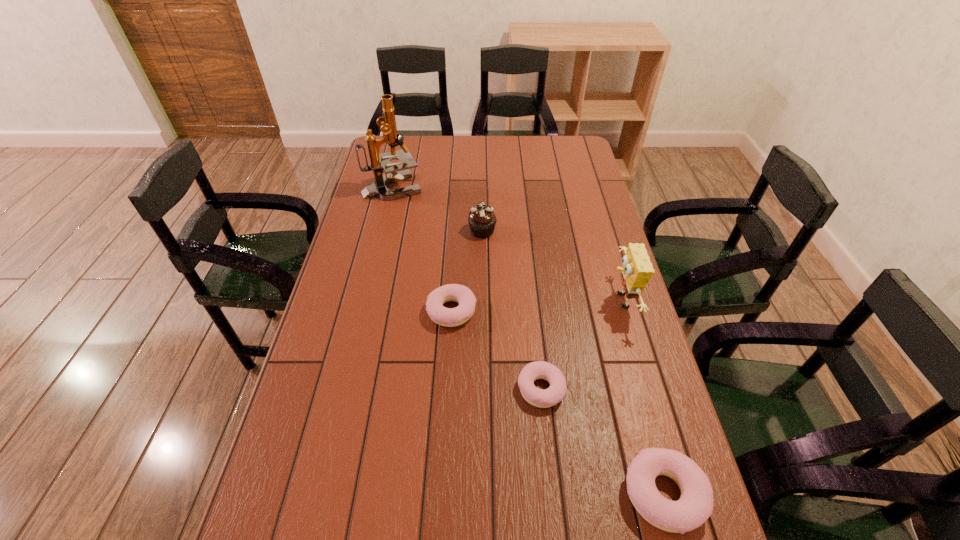
Identify the location of cupcake. The width and height of the screenshot is (960, 540). (482, 220).

Locate an element on the screen. This screenshot has height=540, width=960. free spot located 0.360m on the back of the second shortest doughnut is located at coordinates (457, 219).

Locate an element on the screen. The height and width of the screenshot is (540, 960). vacant space located on the left of the third object from right to left is located at coordinates (384, 388).

You are a GUI agent. You are given a task and a screenshot of the screen. Output one action in this format:
    pyautogui.click(x=<x>, y=<y>)
    Task: Click on the free space located 0.390m on the back of the nearest doughnut
    The image size is (960, 540).
    Given the screenshot: What is the action you would take?
    click(615, 320)

Image resolution: width=960 pixels, height=540 pixels. Identify the location of vacant area situated 0.050m at the eyepiece of the leftmost object. (435, 187).

I want to click on vacant area situated 0.200m on the face of the second tallest object, so click(540, 301).

Image resolution: width=960 pixels, height=540 pixels. In order to click on free spot located 0.090m on the face of the second tallest object in this screenshot , I will do `click(577, 301)`.

Image resolution: width=960 pixels, height=540 pixels. I want to click on free spot located 0.350m on the face of the second tallest object, so click(491, 301).

This screenshot has width=960, height=540. Identify the location of free region located on the back of the second farthest object. (482, 197).

You are a GUI agent. You are given a task and a screenshot of the screen. Output one action in this format:
    pyautogui.click(x=<x>, y=<y>)
    Task: Click on the object that is positioned at the near edge
    The width and height of the screenshot is (960, 540).
    Given the screenshot: What is the action you would take?
    pyautogui.click(x=695, y=506)